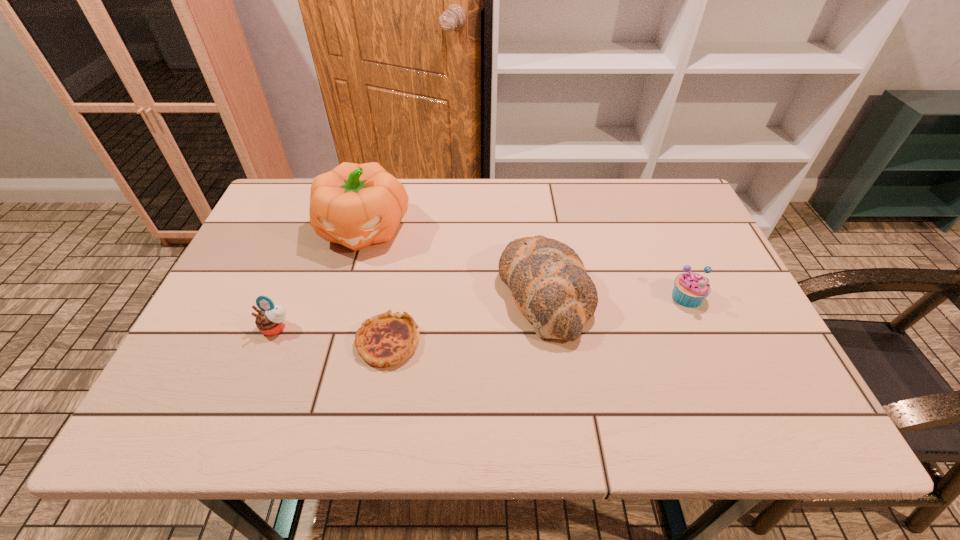
You are a GUI agent. You are given a task and a screenshot of the screen. Output one action in this format:
    pyautogui.click(x=<x>, y=<y>)
    Task: Click on the vacant space positioned on the front of the farther muffin
    
    Given the screenshot: What is the action you would take?
    pyautogui.click(x=710, y=352)

Locate an element on the screen. The height and width of the screenshot is (540, 960). vacant space located on the right of the quiche is located at coordinates (508, 342).

At what (x,y) coordinates should I click in order to perform the action: click on object present at the far edge. Please return your answer as a coordinate pair (x, y). This screenshot has width=960, height=540. Looking at the image, I should click on (356, 205).

This screenshot has height=540, width=960. I want to click on object situated at the left edge, so click(x=271, y=319).

Identify the location of object positioned at the right edge. Image resolution: width=960 pixels, height=540 pixels. (690, 289).

Find the location of a particular element. The height and width of the screenshot is (540, 960). vacant area at the far edge is located at coordinates (492, 180).

In the image, there is a desktop. What are the coordinates of `vacant region at the near edge` in the screenshot? It's located at (275, 422).

The width and height of the screenshot is (960, 540). In the image, there is a desktop. Find the location of `free region at the left edge`. free region at the left edge is located at coordinates (284, 294).

Identify the location of free space at the right edge. pos(718,352).

Where is `vacant region at the far left corner of the desktop`? vacant region at the far left corner of the desktop is located at coordinates (294, 187).